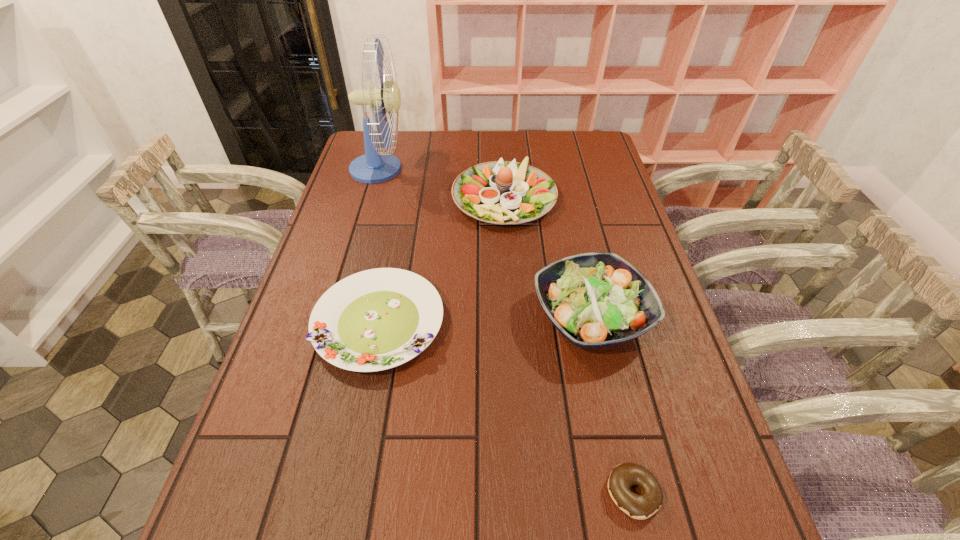
Image resolution: width=960 pixels, height=540 pixels. What are the coordinates of `the tallest object` in the screenshot? It's located at (374, 166).

Locate an element on the screen. This screenshot has height=540, width=960. the farthest salad plate is located at coordinates [x=501, y=192].

Find the location of `the fourth tallest object`. the fourth tallest object is located at coordinates (377, 319).

Identify the location of the nearest object. Image resolution: width=960 pixels, height=540 pixels. (623, 476).

Find the location of a particular element. the shortest object is located at coordinates (623, 476).

This screenshot has width=960, height=540. Identify the location of vacant region located at the front of the tallest object where the blades are visible. click(508, 169).

The height and width of the screenshot is (540, 960). Find the location of `vacant area located 0.120m on the back of the farthest salad plate`. vacant area located 0.120m on the back of the farthest salad plate is located at coordinates (501, 150).

Where is `vacant space located on the front of the second shortest object`? The image size is (960, 540). vacant space located on the front of the second shortest object is located at coordinates (363, 406).

Locate an element on the screen. Image resolution: width=960 pixels, height=540 pixels. blank area located on the back of the doughnut is located at coordinates (615, 416).

Where is `object that is at the far edge`? Image resolution: width=960 pixels, height=540 pixels. object that is at the far edge is located at coordinates (374, 166).